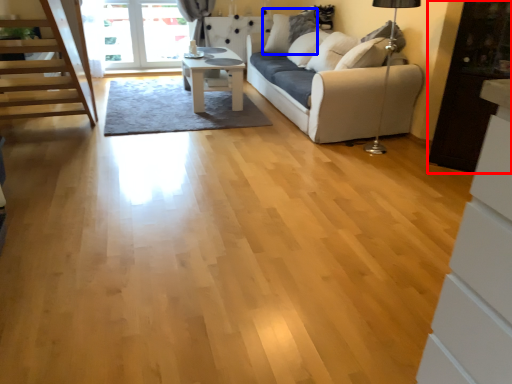
Question: Among these objects, which one is farthest to the camera, cabinetry (highlighted by a red box) or pillow (highlighted by a blue box)?

Choices:
 (A) cabinetry
 (B) pillow

Answer: (B)